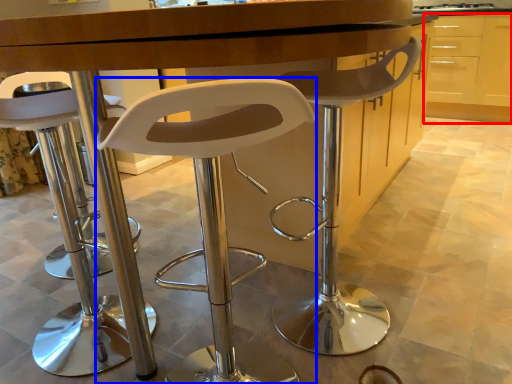
Question: Which object appears farthest to the camera in this image, cabinetry (highlighted by a red box) or chair (highlighted by a blue box)?

Choices:
 (A) cabinetry
 (B) chair

Answer: (A)